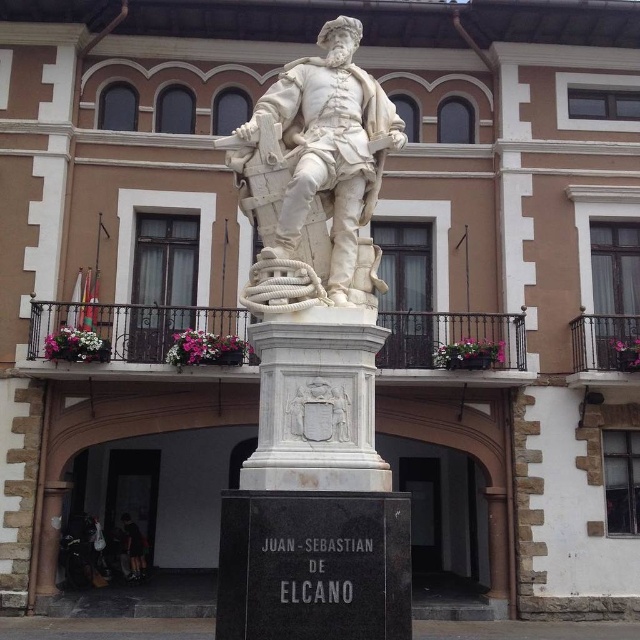
The width and height of the screenshot is (640, 640). What do you see at coordinates (320, 157) in the screenshot?
I see `white marble statue at center` at bounding box center [320, 157].

Which is in front, point (378, 84) or point (125, 544)?

Point (378, 84)

Does point (292, 164) come closer to viewer compared to point (129, 564)?

Yes, point (292, 164) is in front of point (129, 564).

At what (x,y) coordinates should I click in order to perform the action: click on white marble statue at center. Please return your answer as a coordinate pair (x, y). This screenshot has height=640, width=640. Looking at the image, I should click on (320, 157).

Does white marble pedestal at center appear on the right side of dark blue jeans at lower left?

Yes, white marble pedestal at center is to the right of dark blue jeans at lower left.

In the scene shown: Who is positioned more to the right, white marble pedestal at center or dark blue jeans at lower left?

white marble pedestal at center

Which is in front, point (371, 380) or point (124, 518)?

Point (371, 380)

You are a GUI agent. You are given a task and a screenshot of the screen. Output one action in this format:
    pyautogui.click(x=<x>, y=<y>)
    Task: Click on the white marble pedestal at center
    
    Given the screenshot: What is the action you would take?
    pyautogui.click(x=316, y=403)

Does white marble statue at center lie in front of white marble pedestal at center?

No, white marble statue at center is further to the viewer.

From the picture: Can you confirm if white marble statue at center is taller than white marble pedestal at center?

Indeed, white marble statue at center has a greater height compared to white marble pedestal at center.

Which is in front, point (280, 108) or point (368, 486)?

Positioned in front is point (368, 486).

Identify the location of white marble statue at center. coord(320,157).